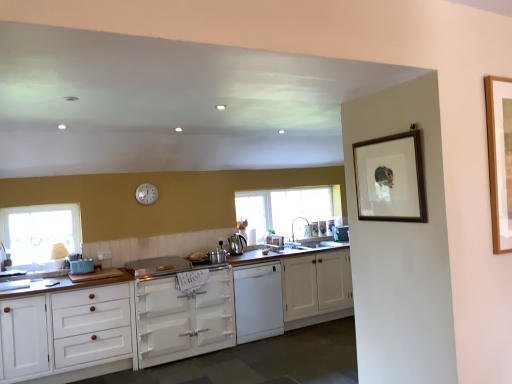
Question: Is white matte oven at center, acting as the second cabinetry starting from the left, far away from satin nickel faucet at center?

Choices:
 (A) no
 (B) yes

Answer: (B)

Question: Does white matte oven at center, acting as the second cabinetry starting from the left, have a lesser width compared to satin nickel faucet at center?

Choices:
 (A) no
 (B) yes

Answer: (A)

Question: Is white matte oven at center, acting as the second cabinetry starting from the left, further to camera compared to satin nickel faucet at center?

Choices:
 (A) yes
 (B) no

Answer: (B)

Question: From the image's perspective, is white matte oven at center, acting as the second cabinetry starting from the left, located beneath satin nickel faucet at center?

Choices:
 (A) no
 (B) yes

Answer: (B)

Question: Is white matte oven at center, acting as the second cabinetry starting from the left, positioned with its back to satin nickel faucet at center?

Choices:
 (A) no
 (B) yes

Answer: (A)

Question: Based on their sizes in the image, would you say white wood cabinet at lower left, positioned as the third cabinetry in right-to-left order, is bigger or smaller than silver metallic pot at center, which is the 5th appliance from back to front?

Choices:
 (A) small
 (B) big

Answer: (B)

Question: In the image, is white wood cabinet at lower left, positioned as the third cabinetry in right-to-left order, on the left side or the right side of silver metallic pot at center, the 2th appliance viewed from the left?

Choices:
 (A) right
 (B) left

Answer: (B)

Question: In terms of width, does white wood cabinet at lower left, positioned as the third cabinetry in right-to-left order, look wider or thinner when compared to silver metallic pot at center, positioned as the second appliance in front-to-back order?

Choices:
 (A) thin
 (B) wide

Answer: (B)

Question: From the image's perspective, is white wood cabinet at lower left, which is counted as the first cabinetry, starting from the left, positioned above or below silver metallic pot at center, positioned as the second appliance in front-to-back order?

Choices:
 (A) below
 (B) above

Answer: (A)

Question: Is clear glass window at center, arranged as the first window when viewed from the back, inside or outside of white metallic clock at upper center?

Choices:
 (A) inside
 (B) outside

Answer: (B)

Question: Considering the positions of clear glass window at center, which is the second window in front-to-back order, and white metallic clock at upper center in the image, is clear glass window at center, which is the second window in front-to-back order, taller or shorter than white metallic clock at upper center?

Choices:
 (A) tall
 (B) short

Answer: (A)

Question: Based on their positions, is clear glass window at center, the 1th window from the right, located to the left or right of white metallic clock at upper center?

Choices:
 (A) right
 (B) left

Answer: (A)

Question: Considering the positions of point (309, 215) and point (148, 185), is point (309, 215) closer or farther from the camera than point (148, 185)?

Choices:
 (A) closer
 (B) farther

Answer: (B)

Question: In terms of size, does white glossy dishwasher at center, marked as the 4th appliance in a right-to-left arrangement, appear bigger or smaller than clear glass window at center, arranged as the 2th window when viewed from the left?

Choices:
 (A) big
 (B) small

Answer: (B)

Question: From the image's perspective, is white glossy dishwasher at center, the fourth appliance in the back-to-front sequence, located above or below clear glass window at center, arranged as the 2th window when viewed from the left?

Choices:
 (A) below
 (B) above

Answer: (A)